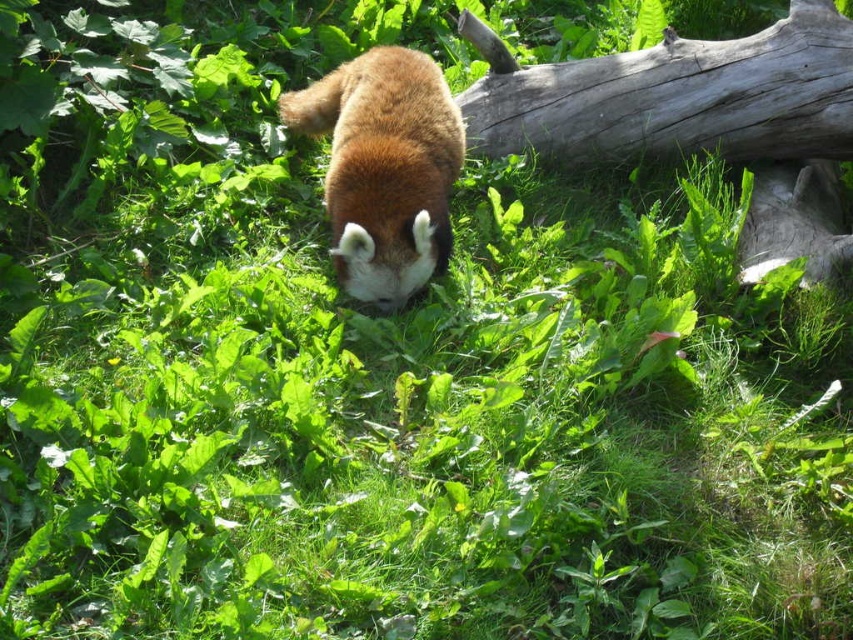
Question: Does gray rough wood at upper right appear over fuzzy reddish-brown bear at center?

Choices:
 (A) no
 (B) yes

Answer: (B)

Question: Which of the following is the closest to the observer?

Choices:
 (A) gray rough wood at upper right
 (B) fuzzy reddish-brown bear at center

Answer: (B)

Question: Which object is closer to the camera taking this photo?

Choices:
 (A) gray rough wood at upper right
 (B) fuzzy reddish-brown bear at center

Answer: (B)

Question: Is gray rough wood at upper right above fuzzy reddish-brown bear at center?

Choices:
 (A) no
 (B) yes

Answer: (B)

Question: Is gray rough wood at upper right wider than fuzzy reddish-brown bear at center?

Choices:
 (A) no
 (B) yes

Answer: (B)